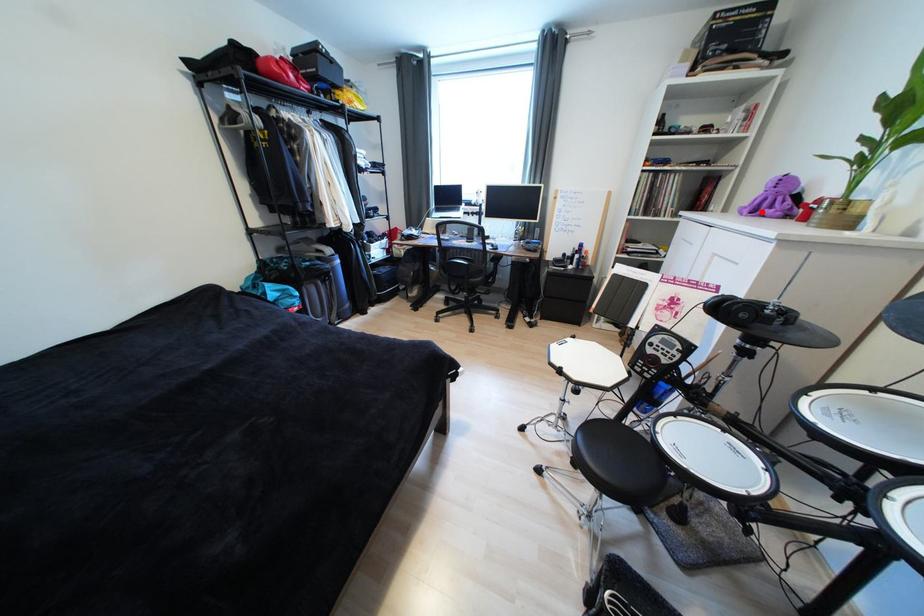
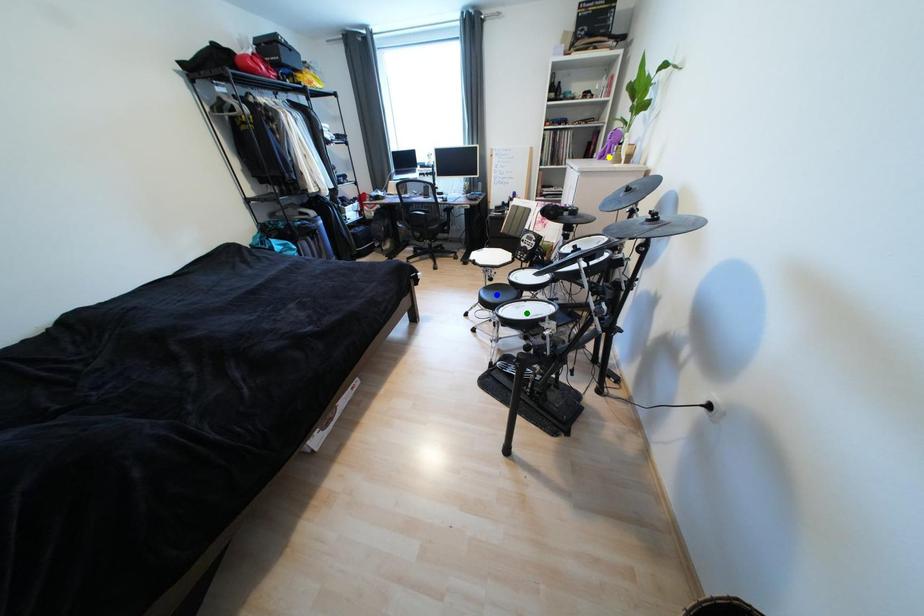
Question: I am providing you with two images of the same scene from different viewpoints. A red point is marked on the first image. You are given multiple points on the second image. Which point in image 2 represents the same 3d spot as the red point in image 1?

Choices:
 (A) green point
 (B) blue point
 (C) yellow point

Answer: (C)